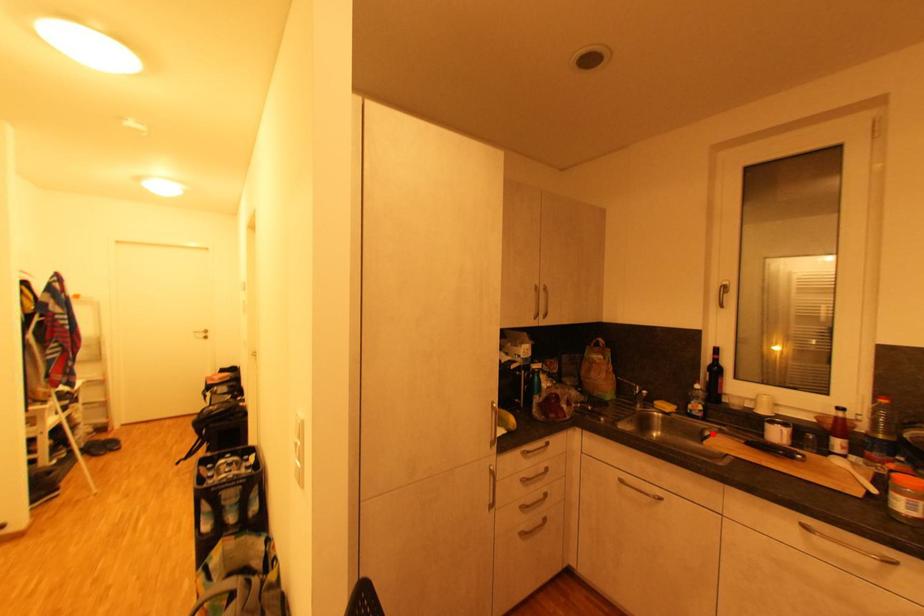
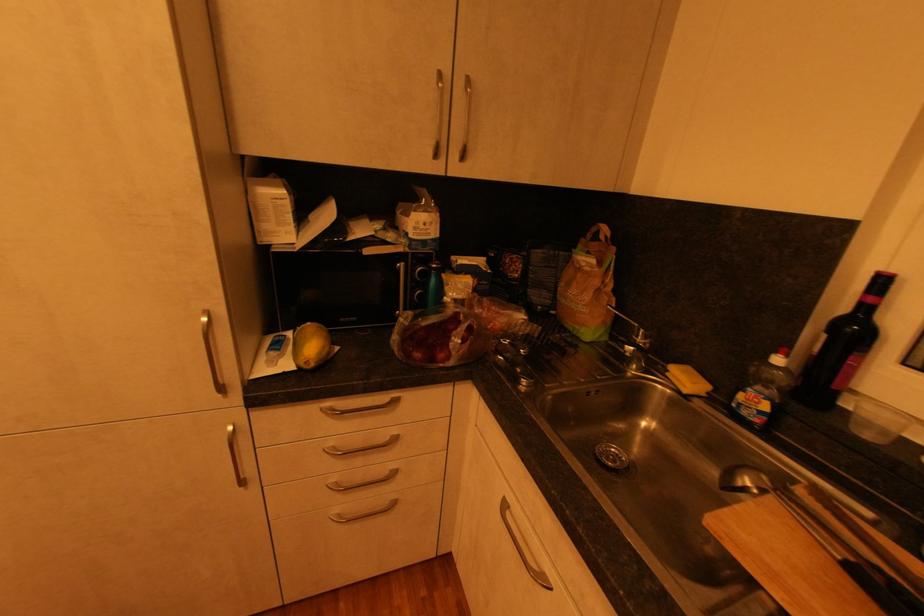
Question: I am providing you with two images of the same scene from different viewpoints. A red point is marked on the first image. At the location where the point appears in image 1, is it still visible in image 2?

Choices:
 (A) Yes
 (B) No

Answer: (A)